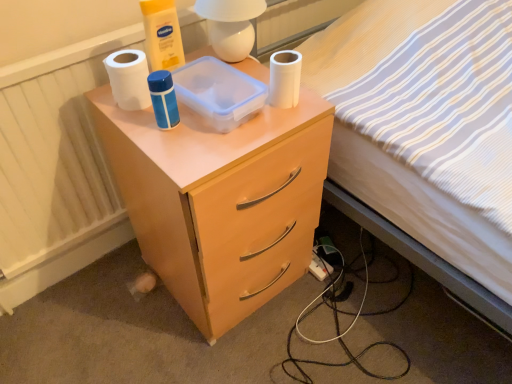
Question: Is matte wood nightstand at center wider than white striped fabric at upper right?

Choices:
 (A) yes
 (B) no

Answer: (B)

Question: Considering the relative positions of matte wood nightstand at center and white striped fabric at upper right in the image provided, is matte wood nightstand at center to the left of white striped fabric at upper right from the viewer's perspective?

Choices:
 (A) yes
 (B) no

Answer: (A)

Question: Does matte wood nightstand at center lie in front of white striped fabric at upper right?

Choices:
 (A) yes
 (B) no

Answer: (B)

Question: Is white striped fabric at upper right inside matte wood nightstand at center?

Choices:
 (A) no
 (B) yes

Answer: (A)

Question: From the image's perspective, is matte wood nightstand at center located above white striped fabric at upper right?

Choices:
 (A) yes
 (B) no

Answer: (B)

Question: Considering the positions of white matte toilet paper at upper center, which is counted as the first toilet paper, starting from the right, and white glossy lamp at upper center in the image, is white matte toilet paper at upper center, which is counted as the first toilet paper, starting from the right, bigger or smaller than white glossy lamp at upper center?

Choices:
 (A) big
 (B) small

Answer: (B)

Question: Considering the positions of point (274, 59) and point (236, 29), is point (274, 59) closer or farther from the camera than point (236, 29)?

Choices:
 (A) closer
 (B) farther

Answer: (A)

Question: From the image's perspective, relative to white glossy lamp at upper center, is white matte toilet paper at upper center, which appears as the 2th toilet paper when viewed from the left, above or below?

Choices:
 (A) above
 (B) below

Answer: (B)

Question: Considering the positions of white matte toilet paper at upper center, which is counted as the first toilet paper, starting from the right, and white glossy lamp at upper center in the image, is white matte toilet paper at upper center, which is counted as the first toilet paper, starting from the right, wider or thinner than white glossy lamp at upper center?

Choices:
 (A) wide
 (B) thin

Answer: (B)

Question: In terms of width, does white plastic power outlet at lower right look wider or thinner when compared to white striped fabric at upper right?

Choices:
 (A) wide
 (B) thin

Answer: (B)

Question: From the image's perspective, is white plastic power outlet at lower right located above or below white striped fabric at upper right?

Choices:
 (A) below
 (B) above

Answer: (A)

Question: Considering the relative positions of white plastic power outlet at lower right and white striped fabric at upper right in the image provided, is white plastic power outlet at lower right to the left or to the right of white striped fabric at upper right?

Choices:
 (A) left
 (B) right

Answer: (A)

Question: From their relative heights in the image, would you say white plastic power outlet at lower right is taller or shorter than white striped fabric at upper right?

Choices:
 (A) tall
 (B) short

Answer: (B)

Question: In terms of width, does transparent plastic container at upper center look wider or thinner when compared to white glossy lamp at upper center?

Choices:
 (A) thin
 (B) wide

Answer: (B)

Question: In terms of size, does transparent plastic container at upper center appear bigger or smaller than white glossy lamp at upper center?

Choices:
 (A) big
 (B) small

Answer: (B)